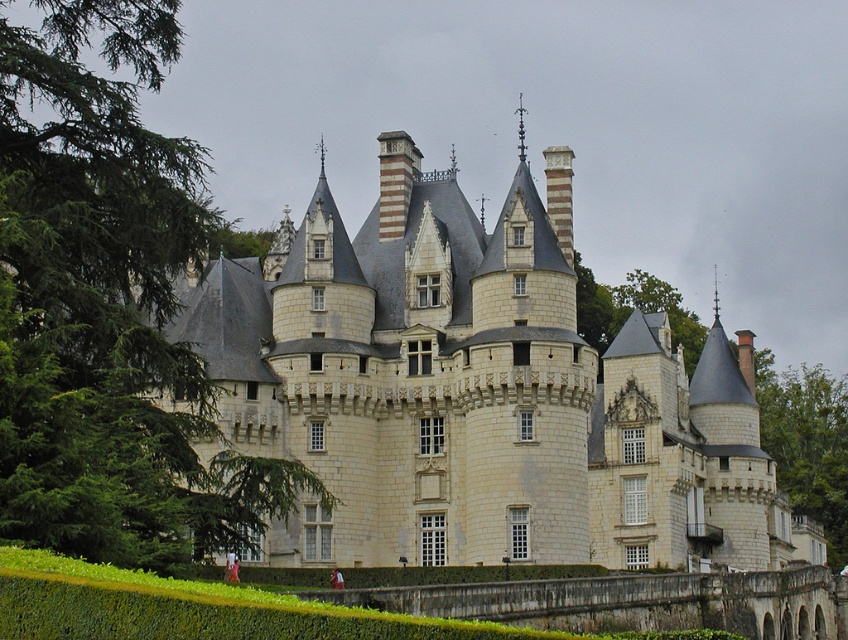
Can you confirm if white stone castle at center is thinner than green leafy tree at left?

No.

Can you confirm if white stone castle at center is positioned to the right of green leafy tree at left?

Yes, white stone castle at center is to the right of green leafy tree at left.

Image resolution: width=848 pixels, height=640 pixels. Describe the element at coordinates (478, 392) in the screenshot. I see `white stone castle at center` at that location.

You are a GUI agent. You are given a task and a screenshot of the screen. Output one action in this format:
    pyautogui.click(x=<x>, y=<y>)
    Task: Click on the white stone castle at center
    
    Given the screenshot: What is the action you would take?
    pyautogui.click(x=478, y=392)